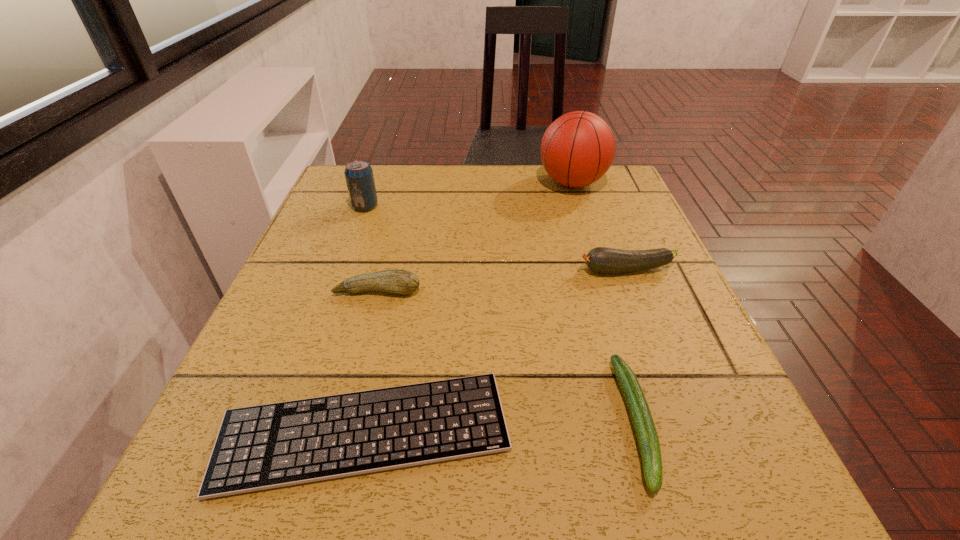
This screenshot has height=540, width=960. What are the coordinates of `the tallest object` in the screenshot? It's located at (577, 149).

This screenshot has height=540, width=960. I want to click on pop soda, so click(x=359, y=177).

Find the location of `the fourth nearest object`. the fourth nearest object is located at coordinates (600, 259).

At what (x,y) coordinates should I click in order to perform the action: click on the leftmost zucchini. Please return your answer as a coordinate pair (x, y). The image size is (960, 540). Looking at the image, I should click on (399, 281).

I want to click on the third nearest object, so click(x=399, y=281).

Locate an element on the screen. The width and height of the screenshot is (960, 540). the fifth tallest object is located at coordinates (646, 433).

Locate an element on the screen. the shortest zucchini is located at coordinates (646, 433).

Find the location of a particular element. This screenshot has height=540, width=960. the shortest object is located at coordinates (267, 446).

The image size is (960, 540). I want to click on vacant area situated on the left of the tallest object, so click(x=442, y=183).

I want to click on free point located 0.090m on the right of the pop soda, so click(416, 206).